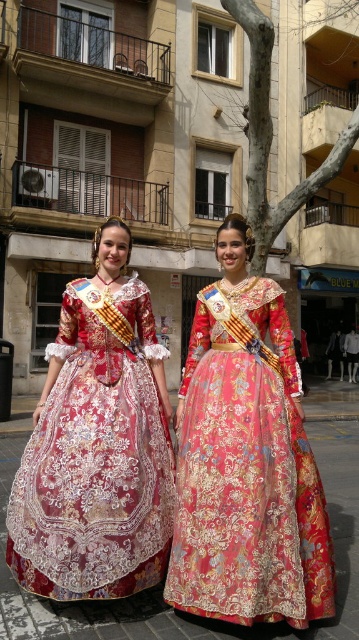
You are a photographer at the event and need to position the two subjects so that their dresses are fully visible in the frame. Given that the embroidered silk dress at center is smaller than the shiny silk dress at center, which dress should be placed closer to the camera to ensure both are captured clearly?

The embroidered silk dress at center should be placed closer to the camera since it is smaller in size compared to the shiny silk dress at center, ensuring both dresses are visible in the frame.

You are an artist trying to sketch the scene. You need to place the embroidered silk dress at center in your drawing. Where should you position it on your canvas using coordinates?

The embroidered silk dress at center should be placed at coordinates approximately 0.736 on the x axis and 0.688 on the y axis.

You are a photographer positioned in front of the two dresses. You want to take a photo that focuses on the embroidered silk dress at center without the shiny silk dress at center appearing too prominent. Which dress should you move closer to the camera to achieve this?

The embroidered silk dress at center is already closer to the viewer than the shiny silk dress at center. To make the embroidered silk dress at center the focus, you can move closer to it, making it larger in the frame while the shiny silk dress at center remains further back and less prominent.